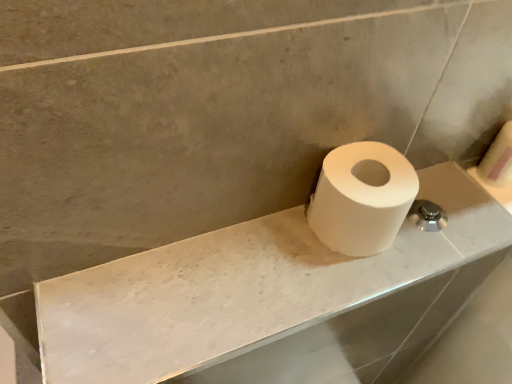
Question: In terms of height, does white matte toilet paper at right, the first toilet paper from the right, look taller or shorter compared to white matte toilet paper at right, which is the 1th toilet paper from front to back?

Choices:
 (A) tall
 (B) short

Answer: (A)

Question: Relative to white matte toilet paper at right, which ranks as the first toilet paper in left-to-right order, is white matte toilet paper at right, the 1th toilet paper positioned from the back, in front or behind?

Choices:
 (A) front
 (B) behind

Answer: (B)

Question: Which object is positioned farthest from the white marble counter top at center?

Choices:
 (A) white matte toilet paper at right, which ranks as the first toilet paper in left-to-right order
 (B) white matte toilet paper at right, the first toilet paper from the right

Answer: (B)

Question: Which of these objects is positioned farthest from the white matte toilet paper at right, the 1th toilet paper positioned from the back?

Choices:
 (A) white matte toilet paper at right, positioned as the 2th toilet paper in back-to-front order
 (B) white marble counter top at center

Answer: (B)